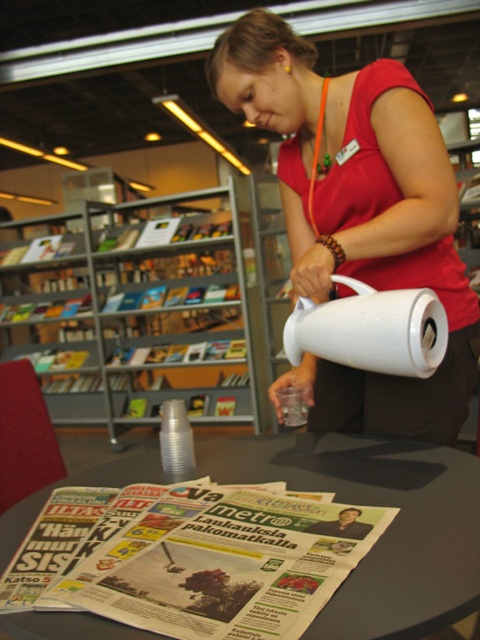
Who is positioned more to the right, black plastic table at lower center or white matte jug at center?

Positioned to the right is white matte jug at center.

What do you see at coordinates (385, 531) in the screenshot?
I see `black plastic table at lower center` at bounding box center [385, 531].

Does point (111, 474) come in front of point (427, 310)?

No, (111, 474) is behind (427, 310).

This screenshot has height=640, width=480. I want to click on black plastic table at lower center, so click(385, 531).

Is metallic gray bookshelf at left positioned at the back of white matte jug at center?

Yes, it is.

Can you confirm if metallic gray bookshelf at left is thinner than white matte jug at center?

No.

The width and height of the screenshot is (480, 640). What are the coordinates of `metallic gray bookshelf at left` in the screenshot? It's located at (144, 314).

Does metallic gray bookshelf at left have a greater width compared to black plastic table at lower center?

Yes, metallic gray bookshelf at left is wider than black plastic table at lower center.

Is metallic gray bookshelf at left smaller than black plastic table at lower center?

Actually, metallic gray bookshelf at left might be larger than black plastic table at lower center.

Find the location of a particular element. The width and height of the screenshot is (480, 640). metallic gray bookshelf at left is located at coordinates (144, 314).